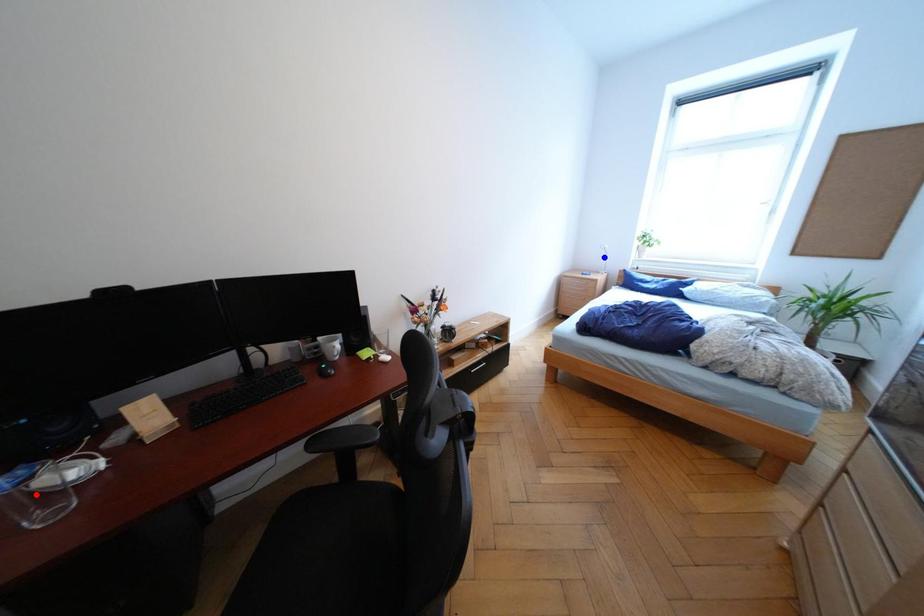
Question: In the image, two points are highlighted. Which point is nearer to the camera? Reply with the corresponding letter.

Choices:
 (A) blue point
 (B) red point

Answer: (B)